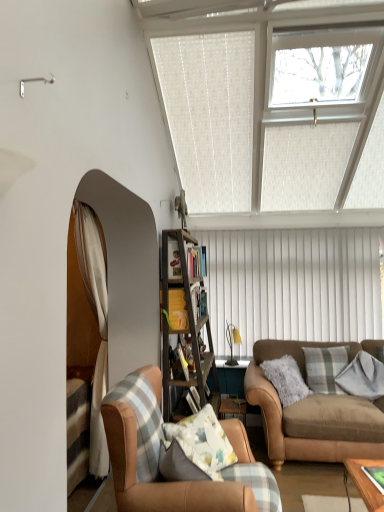
Find the location of `free space above white vertical blinds at center (from a real-world perspective)`. free space above white vertical blinds at center (from a real-world perspective) is located at coordinates (274, 223).